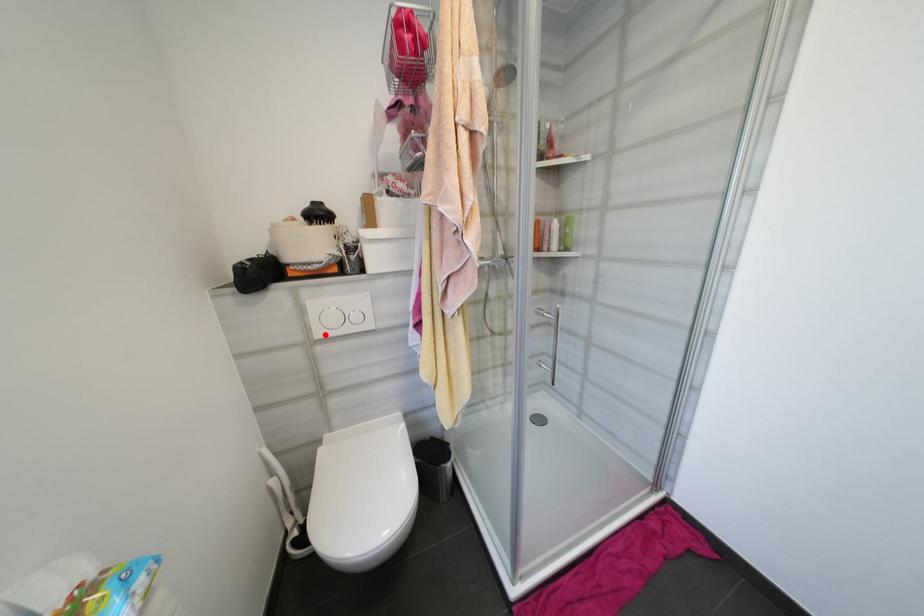
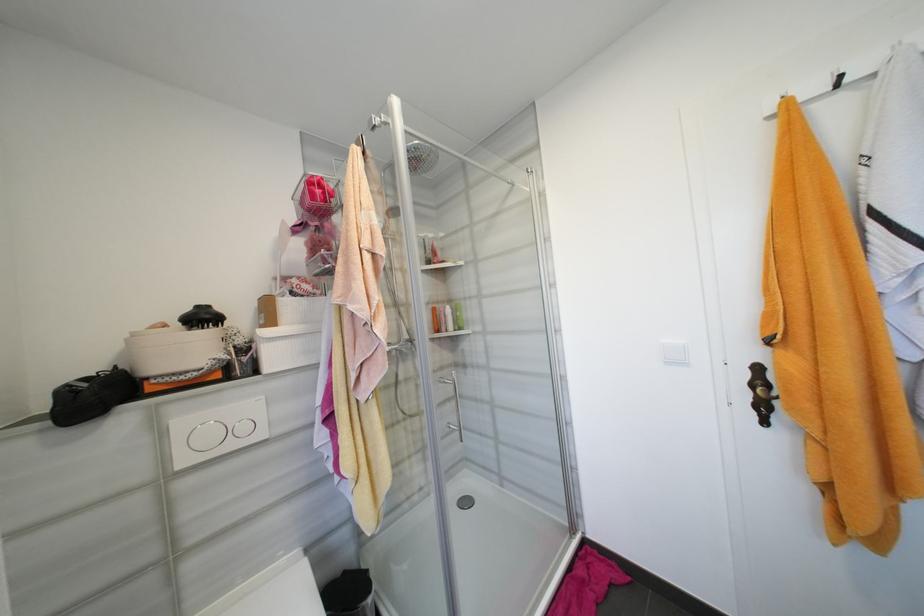
In the second image, find the point that corresponds to the highlighted location in the first image.

(189, 463)